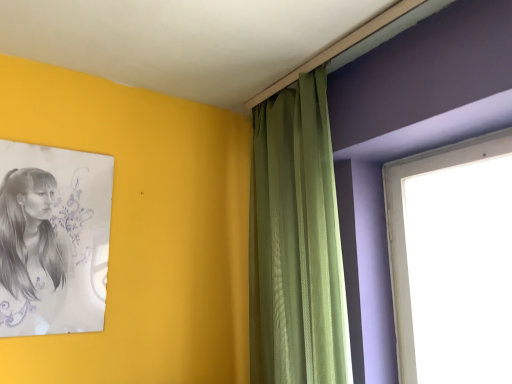
Find the location of a particular element. Image resolution: width=512 pixels, height=384 pixels. black paper portrait at left is located at coordinates (29, 254).

Describe the element at coordinates (29, 254) in the screenshot. I see `black paper portrait at left` at that location.

Image resolution: width=512 pixels, height=384 pixels. What do you see at coordinates (297, 241) in the screenshot?
I see `green textured curtain at upper center` at bounding box center [297, 241].

Identify the location of green textured curtain at upper center. (297, 241).

Locate an element on the screen. black paper portrait at left is located at coordinates (29, 254).

Is green textured curtain at upper center at the right side of black paper portrait at left?

Yes.

Does green textured curtain at upper center come behind black paper portrait at left?

No, it is not.

Considering the points (261, 234) and (21, 229), which point is behind, point (261, 234) or point (21, 229)?

The point (261, 234) is behind.

Consider the image. From the image's perspective, which one is positioned lower, green textured curtain at upper center or black paper portrait at left?

black paper portrait at left appears lower in the image.

From a real-world perspective, is green textured curtain at upper center positioned above or below black paper portrait at left?

green textured curtain at upper center is situated higher than black paper portrait at left in the real world.

Can you confirm if green textured curtain at upper center is thinner than black paper portrait at left?

In fact, green textured curtain at upper center might be wider than black paper portrait at left.

Considering the sizes of green textured curtain at upper center and black paper portrait at left in the image, is green textured curtain at upper center taller or shorter than black paper portrait at left?

Considering their sizes, green textured curtain at upper center has more height than black paper portrait at left.

Which of these two, green textured curtain at upper center or black paper portrait at left, is smaller?

black paper portrait at left is smaller.

Is green textured curtain at upper center inside or outside of black paper portrait at left?

The correct answer is: outside.

Is the surface of green textured curtain at upper center in direct contact with black paper portrait at left?

No, green textured curtain at upper center is not next to black paper portrait at left.

Is green textured curtain at upper center facing towards black paper portrait at left?

Yes, green textured curtain at upper center is turned towards black paper portrait at left.

Where is `woman below the green textured curtain at upper center (from the image's perspective)`? The image size is (512, 384). woman below the green textured curtain at upper center (from the image's perspective) is located at coordinates (29, 254).

Is black paper portrait at left to the left of green textured curtain at upper center from the viewer's perspective?

Indeed, black paper portrait at left is positioned on the left side of green textured curtain at upper center.

Which object is closer to the camera taking this photo, black paper portrait at left or green textured curtain at upper center?

green textured curtain at upper center is more forward.

Between point (38, 185) and point (290, 113), which one is positioned in front?

The point (38, 185) is closer to the camera.

From the image's perspective, is black paper portrait at left under green textured curtain at upper center?

Yes.

From a real-world perspective, who is located lower, black paper portrait at left or green textured curtain at upper center?

From a 3D spatial view, black paper portrait at left is below.

Consider the image. Considering the sizes of black paper portrait at left and green textured curtain at upper center in the image, is black paper portrait at left wider or thinner than green textured curtain at upper center?

In the image, black paper portrait at left appears to be more narrow than green textured curtain at upper center.

Considering the sizes of black paper portrait at left and green textured curtain at upper center in the image, is black paper portrait at left taller or shorter than green textured curtain at upper center?

black paper portrait at left is shorter than green textured curtain at upper center.

Is black paper portrait at left bigger than green textured curtain at upper center?

Actually, black paper portrait at left might be smaller than green textured curtain at upper center.

Would you say black paper portrait at left contains green textured curtain at upper center?

No, green textured curtain at upper center is not surrounded by black paper portrait at left.

Are black paper portrait at left and green textured curtain at upper center making contact?

black paper portrait at left and green textured curtain at upper center are clearly separated.

Could you tell me if black paper portrait at left is turned towards green textured curtain at upper center?

No, black paper portrait at left is not turned towards green textured curtain at upper center.

How different are the orientations of black paper portrait at left and green textured curtain at upper center in degrees?

The angle between the facing direction of black paper portrait at left and the facing direction of green textured curtain at upper center is 90 degrees.

The image size is (512, 384). Identify the location of curtain on the right of black paper portrait at left. (297, 241).

Find the location of a particular element. This screenshot has width=512, height=384. woman to the left of green textured curtain at upper center is located at coordinates (29, 254).

Locate an element on the screen. The image size is (512, 384). curtain above the black paper portrait at left (from the image's perspective) is located at coordinates (297, 241).